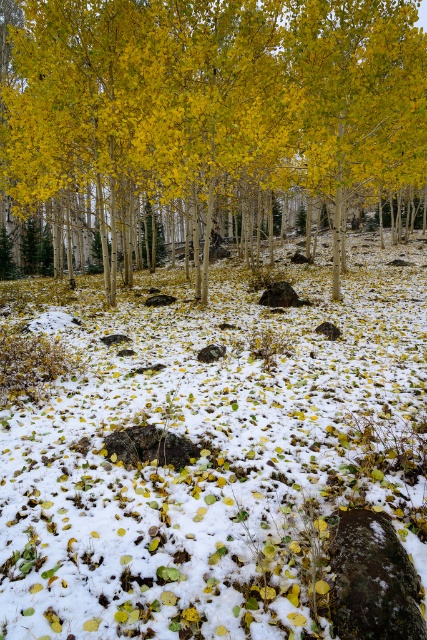
You are standing in the autumnal forest scene and want to take a photo. You notice two points in the image labeled as point (201,387) and point (75,74). Which point should you focus on first if you want to capture the closest object to the camera in your shot?

Point (201,387) is closer to the camera than point (75,74), so you should focus on point (201,387) first to capture the closest object in your shot.

You are a hiker standing at the edge of the forest. You see the white fluffy snow at center and the yellow matte tree at center. How far apart are these two landmarks from each other?

The white fluffy snow at center and the yellow matte tree at center are 30.72 meters apart from each other.

You are standing in the autumnal forest scene and want to place a small pinecone between the white fluffy snow at center and the yellow matte tree at center. Based on their positions, which object should the pinecone be closer to?

The white fluffy snow at center is to the left of the yellow matte tree at center, so the pinecone should be placed between them, closer to the white fluffy snow at center since it is positioned to the left.